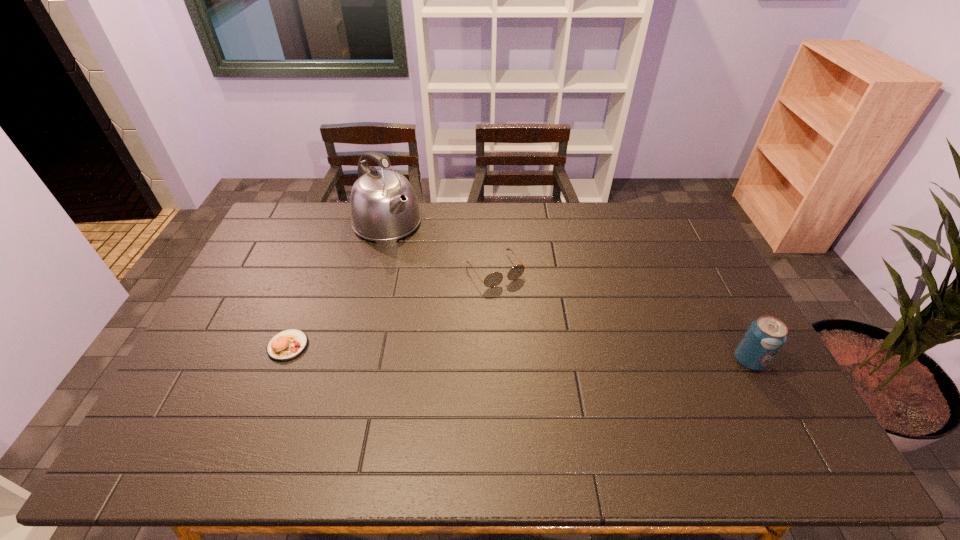
I want to click on free space on the desktop that is between the patty and the third shortest object and is positioned on the spout of the kettle, so tap(520, 353).

I want to click on vacant space on the desktop that is between the leftmost object and the rightmost object and is positioned on the lenses of the sunglasses, so click(x=555, y=354).